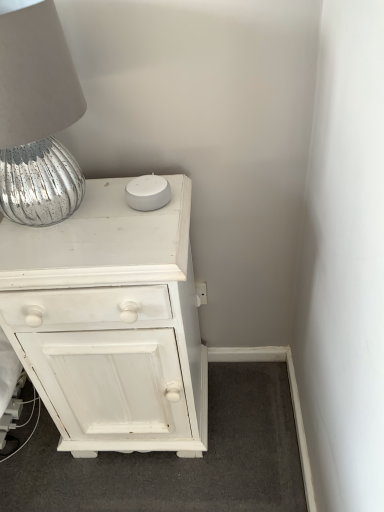
The height and width of the screenshot is (512, 384). I want to click on vacant point to the right of silver textured lampshade at upper left, so click(x=142, y=210).